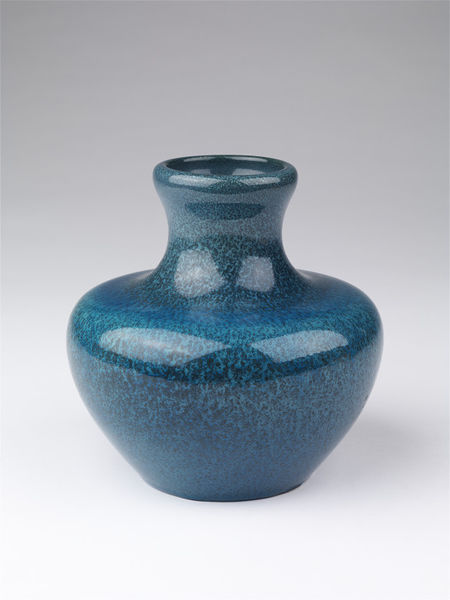
The height and width of the screenshot is (600, 450). Identify the location of wall. (232, 121).